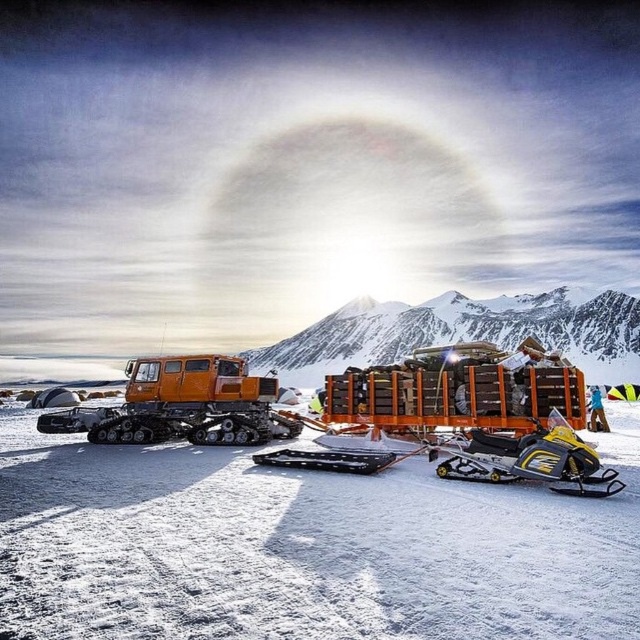
You are a hiker planning to cross the area where the white powdery snow at center and the orange metallic tracked vehicle at left are located. Based on the scene, which object would you encounter first if you approach from the direction of the sun?

The white powdery snow at center is in front of the orange metallic tracked vehicle at left, so you would encounter the white powdery snow at center first when approaching from the sun direction.

You are standing at the base of the mountain and see two points marked on the snowy landscape. The first point is at coordinates point (118,550) and the second is at point (532,460). Which point is closer to you?

Point (118,550) is in front of point (532,460), so it is closer to you.

You are planning to take a photo of the snowy rocky mountain at upper center and the orange metallic tracked vehicle at left. Which object should you focus on first if you want to capture both in the same frame without moving the camera?

You should focus on the snowy rocky mountain at upper center first because it is much taller than the orange metallic tracked vehicle at left, so it will require adjusting the camera angle to include its height while keeping the vehicle in frame.